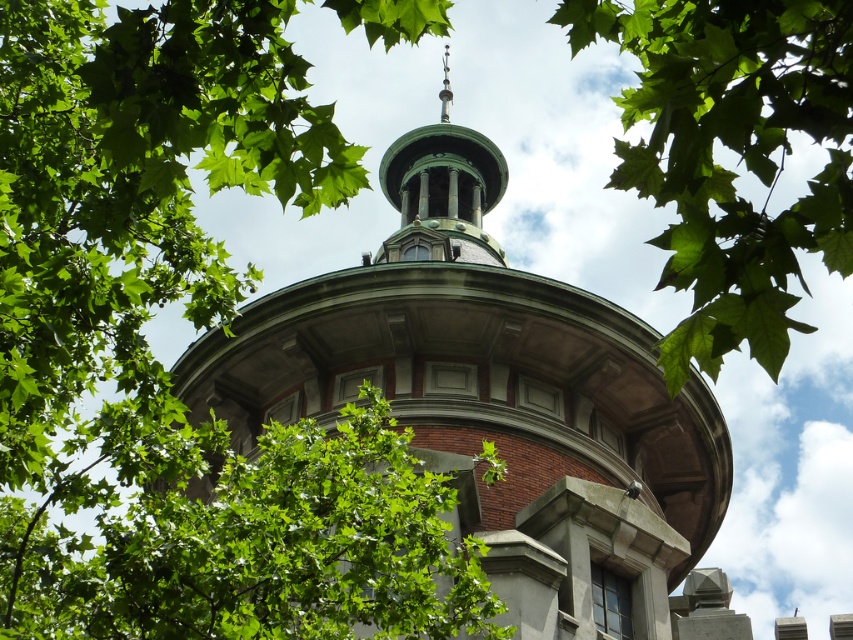
In the scene shown: You are standing at the base of the building and looking up at the dome. There are two points marked on the dome surface. The first point is at coordinates point (268, 356) and the second point is at point (604, 13). Which point is closer to the top of the dome?

Point (604, 13) is closer to the top of the dome because it is in front of point (268, 356), which is behind it.

Consider the image. You are standing in front of a building and see the green polished dome at center. If you want to take a photo of it from a distance of 50 meters, can you move closer to get a better shot?

The green polished dome at center is currently 51.20 meters away from you. To take a photo from 50 meters, you need to move 1.20 meters closer.